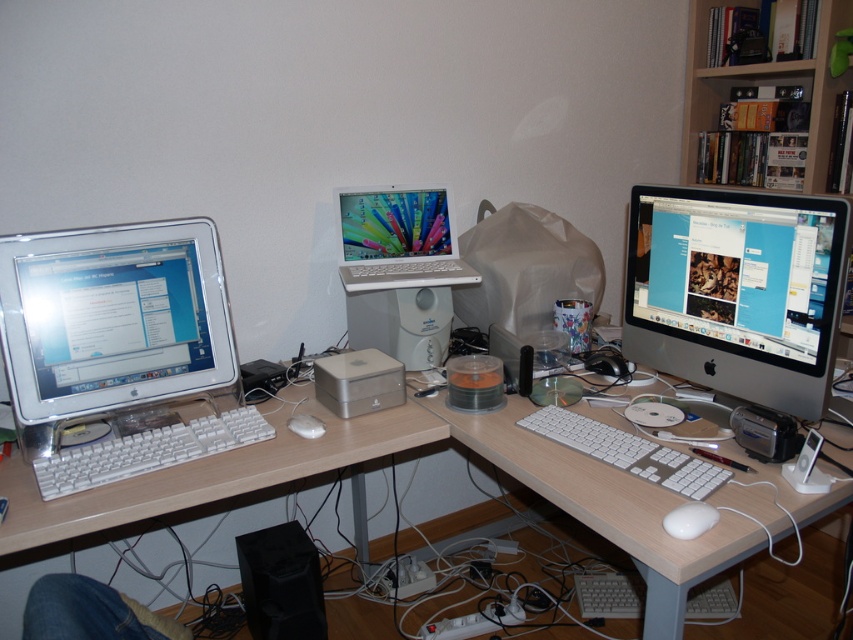
You are organizing the desk and want to place a new item between the white plastic laptop at center and the white matte keyboard at center. Is there space between them?

The white plastic laptop at center is to the left of the white matte keyboard at center, so there is space between them to place the new item.

You are organizing cables on the desk and need to place the white plastic keyboard at left and the white matte mouse at lower right. Since space is limited, which object requires more desk space due to its size?

The white plastic keyboard at left requires more desk space because it is larger in size than the white matte mouse at lower right.

You are organizing a space and need to know if the wooden bookshelf at upper right can be placed vertically next to the white plastic keyboard at left without blocking the keyboard. Can it fit vertically?

The wooden bookshelf at upper right is taller than the white plastic keyboard at left, so it can be placed vertically next to it without blocking the keyboard as it is taller and would not interfere with the keyboard.